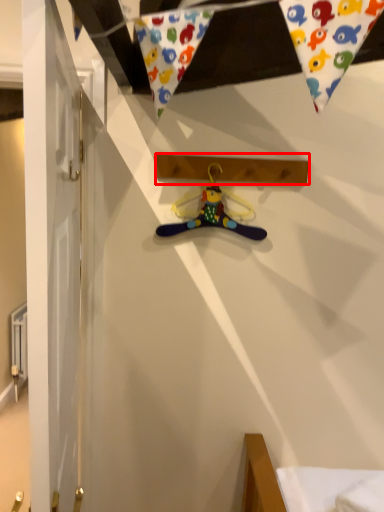
Question: From the image's perspective, where is plank (annotated by the red box) located in relation to hanger in the image?

Choices:
 (A) below
 (B) above

Answer: (B)